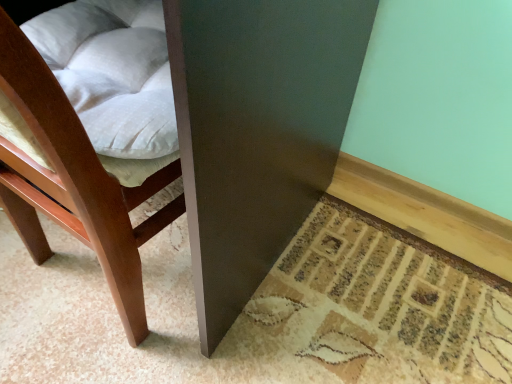
Identify the location of matte wood chair at lower left. The width and height of the screenshot is (512, 384). (74, 182).

The height and width of the screenshot is (384, 512). What do you see at coordinates (74, 182) in the screenshot? I see `matte wood chair at lower left` at bounding box center [74, 182].

Describe the element at coordinates (257, 130) in the screenshot. This screenshot has width=512, height=384. I see `matte dark brown table at lower center` at that location.

At what (x,y) coordinates should I click in order to perform the action: click on matte dark brown table at lower center. Please return your answer as a coordinate pair (x, y). Looking at the image, I should click on (257, 130).

You are a GUI agent. You are given a task and a screenshot of the screen. Output one action in this format:
    pyautogui.click(x=<x>, y=<y>)
    Task: Click on the matte wood chair at lower left
    The width and height of the screenshot is (512, 384).
    Given the screenshot: What is the action you would take?
    pyautogui.click(x=74, y=182)

From the picture: Considering the relative positions of matte dark brown table at lower center and matte wood chair at lower left in the image provided, is matte dark brown table at lower center to the right of matte wood chair at lower left from the viewer's perspective?

In fact, matte dark brown table at lower center is to the left of matte wood chair at lower left.

Is matte dark brown table at lower center positioned behind matte wood chair at lower left?

Yes, it is.

Does point (240, 241) appear closer or farther from the camera than point (48, 210)?

Point (240, 241) is positioned farther from the camera compared to point (48, 210).

From the image's perspective, is matte dark brown table at lower center above matte wood chair at lower left?

Yes, from the image's perspective, matte dark brown table at lower center is above matte wood chair at lower left.

From a real-world perspective, is matte dark brown table at lower center positioned above or below matte wood chair at lower left?

matte dark brown table at lower center is situated higher than matte wood chair at lower left in the real world.

Which of these two, matte dark brown table at lower center or matte wood chair at lower left, is wider?

matte dark brown table at lower center is wider.

Does matte dark brown table at lower center have a greater height compared to matte wood chair at lower left?

Correct, matte dark brown table at lower center is much taller as matte wood chair at lower left.

Considering the relative sizes of matte dark brown table at lower center and matte wood chair at lower left in the image provided, is matte dark brown table at lower center smaller than matte wood chair at lower left?

No.

Is matte wood chair at lower left a part of matte dark brown table at lower center?

Yes, matte wood chair at lower left is a part of matte dark brown table at lower center.

Is there a large distance between matte dark brown table at lower center and matte wood chair at lower left?

matte dark brown table at lower center is actually quite close to matte wood chair at lower left.

Is matte dark brown table at lower center turned away from matte wood chair at lower left?

No, matte dark brown table at lower center is not facing away from matte wood chair at lower left.

How different are the orientations of matte dark brown table at lower center and matte wood chair at lower left in degrees?

matte dark brown table at lower center and matte wood chair at lower left are facing 176 degrees away from each other.

At what (x,y) coordinates should I click in order to perform the action: click on chair lying in front of the matte dark brown table at lower center. Please return your answer as a coordinate pair (x, y). This screenshot has height=384, width=512. Looking at the image, I should click on (74, 182).

Which object is positioned more to the left, matte wood chair at lower left or matte dark brown table at lower center?

matte dark brown table at lower center.

Which object is further away from the camera, matte wood chair at lower left or matte dark brown table at lower center?

matte dark brown table at lower center.

Is point (66, 229) positioned before point (309, 35)?

No, it is not.

Looking at this image, from the image's perspective, between matte wood chair at lower left and matte dark brown table at lower center, which one is located above?

From the image's view, matte dark brown table at lower center is above.

From a real-world perspective, is matte wood chair at lower left under matte dark brown table at lower center?

Yes, from a real-world perspective, matte wood chair at lower left is below matte dark brown table at lower center.

Which object is wider, matte wood chair at lower left or matte dark brown table at lower center?

Wider between the two is matte dark brown table at lower center.

Who is shorter, matte wood chair at lower left or matte dark brown table at lower center?

Standing shorter between the two is matte wood chair at lower left.

Does matte wood chair at lower left have a larger size compared to matte dark brown table at lower center?

No.

Would you say matte wood chair at lower left is inside or outside matte dark brown table at lower center?

matte wood chair at lower left is contained in matte dark brown table at lower center.

Would you consider matte wood chair at lower left to be distant from matte dark brown table at lower center?

No, matte wood chair at lower left is not far from matte dark brown table at lower center.

Is matte wood chair at lower left oriented towards matte dark brown table at lower center?

Yes, matte wood chair at lower left is aimed at matte dark brown table at lower center.

Looking at this image, what's the angular difference between matte wood chair at lower left and matte dark brown table at lower center's facing directions?

They differ by 176 degrees in their facing directions.

Locate an element on the screen. The image size is (512, 384). table positioned vertically above the matte wood chair at lower left (from a real-world perspective) is located at coordinates (257, 130).

The height and width of the screenshot is (384, 512). What are the coordinates of `chair that appears in front of the matte dark brown table at lower center` in the screenshot? It's located at (74, 182).

In the image, there is a matte dark brown table at lower center. Where is `chair below it (from the image's perspective)`? Image resolution: width=512 pixels, height=384 pixels. chair below it (from the image's perspective) is located at coordinates (74, 182).